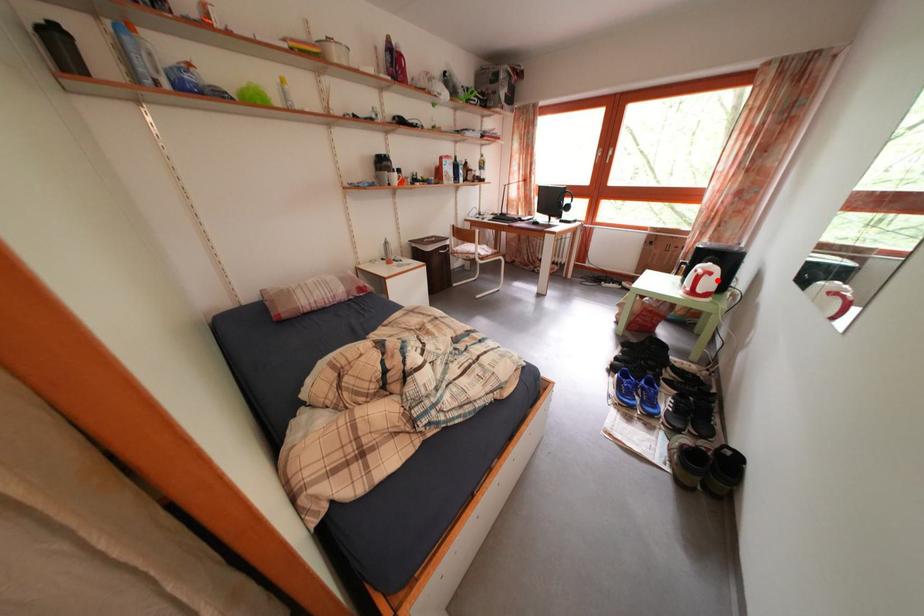
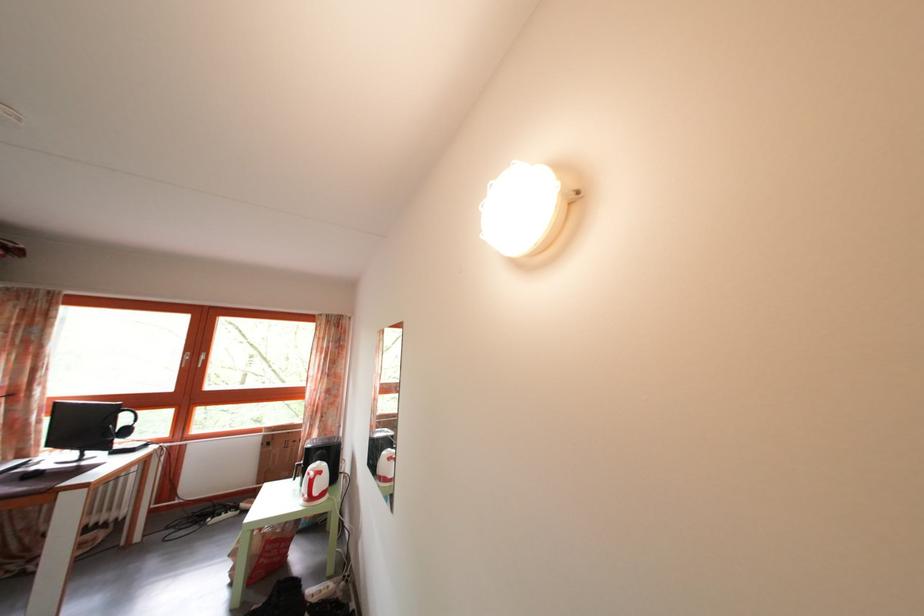
Question: I am providing you with two images of the same scene from different viewpoints. In image1, a red point is highlighted. Considering the same 3D point in image2, which of the following is correct?

Choices:
 (A) It is closer
 (B) It is farther

Answer: (B)